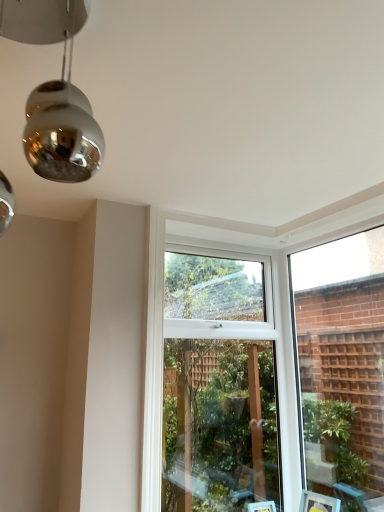
Question: Considering the relative sizes of clear glass window at center and clear glass window at upper right in the image provided, is clear glass window at center smaller than clear glass window at upper right?

Choices:
 (A) no
 (B) yes

Answer: (A)

Question: Can you confirm if clear glass window at center is shorter than clear glass window at upper right?

Choices:
 (A) no
 (B) yes

Answer: (A)

Question: Is clear glass window at center not within clear glass window at upper right?

Choices:
 (A) no
 (B) yes

Answer: (B)

Question: Considering the relative sizes of clear glass window at center and clear glass window at upper right in the image provided, is clear glass window at center bigger than clear glass window at upper right?

Choices:
 (A) no
 (B) yes

Answer: (B)

Question: Is the depth of clear glass window at center less than that of clear glass window at upper right?

Choices:
 (A) yes
 (B) no

Answer: (B)

Question: Does clear glass window at center turn towards clear glass window at upper right?

Choices:
 (A) yes
 (B) no

Answer: (A)

Question: From the image's perspective, would you say clear glass window at upper right is positioned over clear glass window at center?

Choices:
 (A) no
 (B) yes

Answer: (B)

Question: Is clear glass window at upper right closer to camera compared to clear glass window at center?

Choices:
 (A) yes
 (B) no

Answer: (A)

Question: Can you confirm if clear glass window at upper right is positioned to the left of clear glass window at center?

Choices:
 (A) no
 (B) yes

Answer: (A)

Question: Is clear glass window at upper right bigger than clear glass window at center?

Choices:
 (A) yes
 (B) no

Answer: (B)

Question: Is clear glass window at upper right located outside clear glass window at center?

Choices:
 (A) yes
 (B) no

Answer: (A)

Question: Can you confirm if clear glass window at upper right is taller than clear glass window at center?

Choices:
 (A) yes
 (B) no

Answer: (B)

Question: Looking at their shapes, would you say clear glass window at center is wider or thinner than clear glass window at upper right?

Choices:
 (A) thin
 (B) wide

Answer: (B)